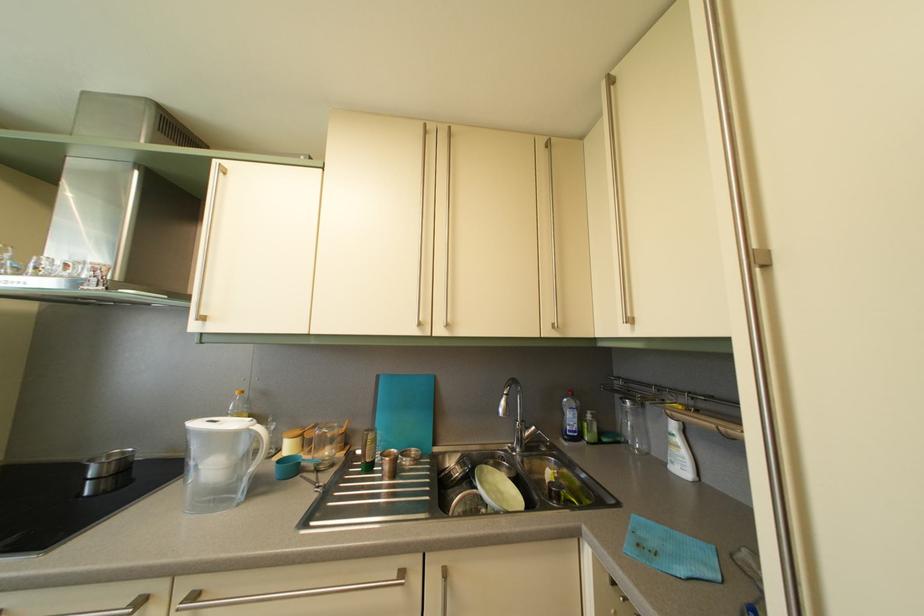
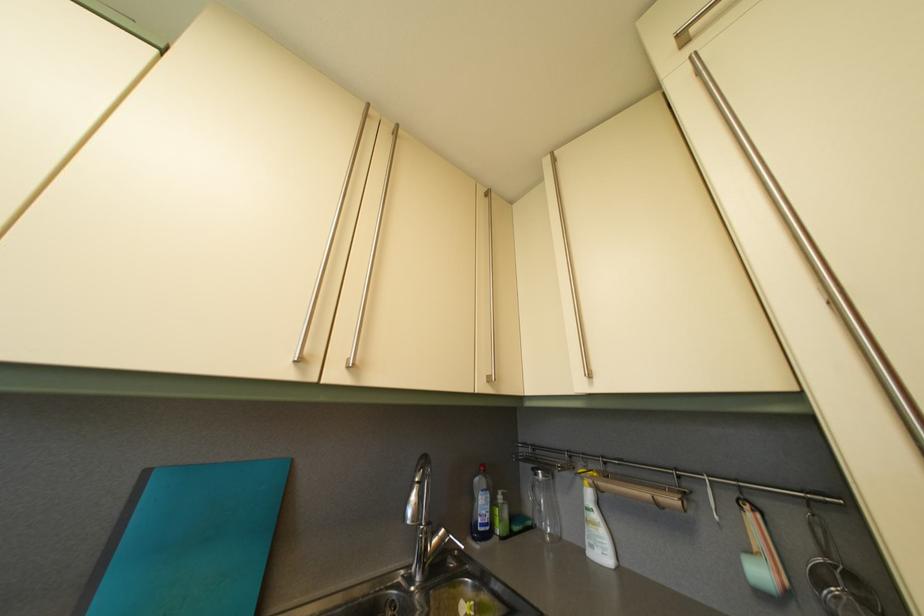
The point at (385, 384) is marked in the first image. Where is the corresponding point in the second image?

(154, 480)